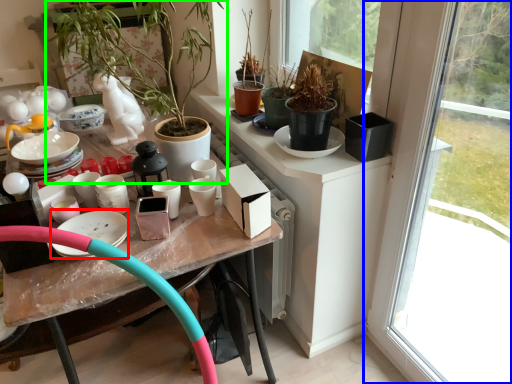
Question: Estimate the real-world distances between objects in this image. Which object is closer to tableware (highlighted by a red box), window (highlighted by a blue box) or houseplant (highlighted by a green box)?

Choices:
 (A) window
 (B) houseplant

Answer: (B)